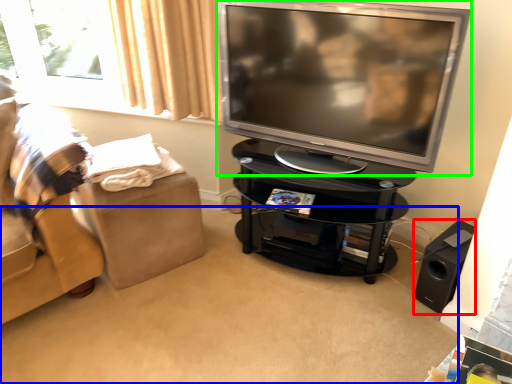
Question: Based on their relative distances, which object is nearer to speaker (highlighted by a red box)? Choose from plain (highlighted by a blue box) and television (highlighted by a green box).

Choices:
 (A) plain
 (B) television

Answer: (A)